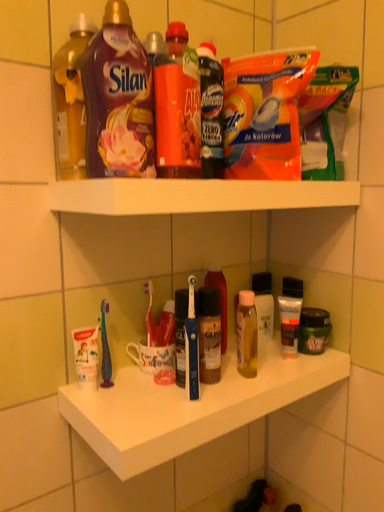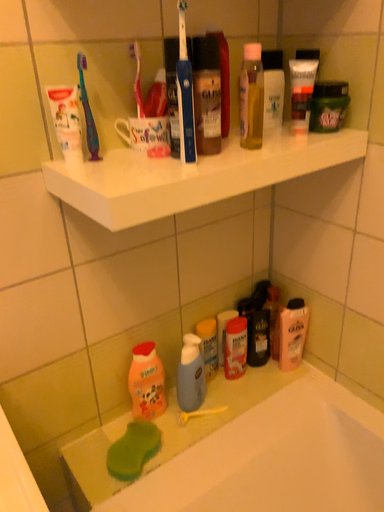
Question: How did the camera likely rotate when shooting the video?

Choices:
 (A) rotated downward
 (B) rotated upward

Answer: (A)